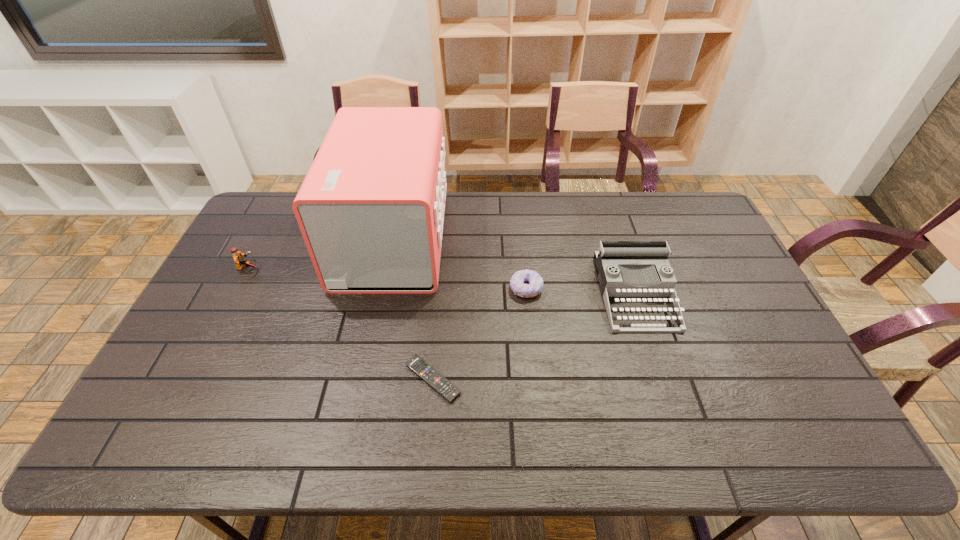
This screenshot has height=540, width=960. I want to click on vacant position in the image that satisfies the following two spatial constraints: 1. on the surface of the shortest object where the text is embossed; 2. on the left side of the tallest object, so click(364, 379).

Where is `free location that satisfies the following two spatial constraints: 1. on the back side of the doughnut; 2. on the right side of the shortest object`? The height and width of the screenshot is (540, 960). free location that satisfies the following two spatial constraints: 1. on the back side of the doughnut; 2. on the right side of the shortest object is located at coordinates (441, 288).

The image size is (960, 540). In order to click on vacant space that satisfies the following two spatial constraints: 1. on the back side of the nearest object; 2. on the surface of the tallest object where the text is embossed in this screenshot , I will do `click(444, 238)`.

Where is `free region that satisfies the following two spatial constraints: 1. holding a crossbow in the hands of the Lego; 2. on the right side of the doughnut`? The image size is (960, 540). free region that satisfies the following two spatial constraints: 1. holding a crossbow in the hands of the Lego; 2. on the right side of the doughnut is located at coordinates 238,288.